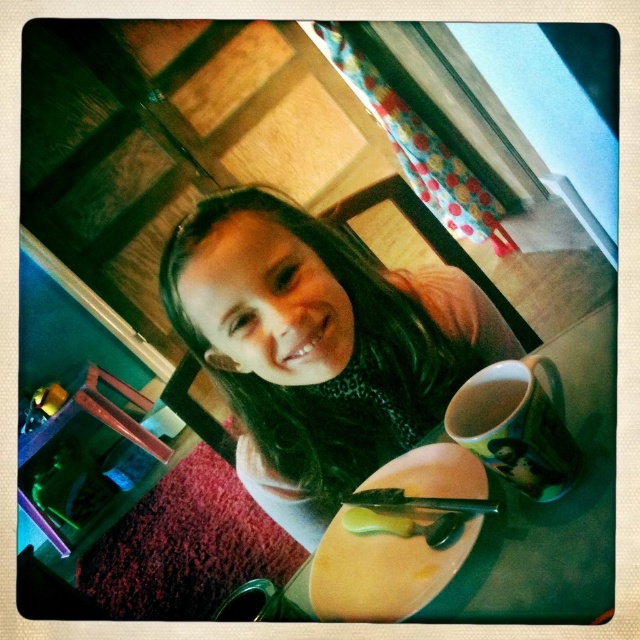
You are a guest at this table and want to place a small napkin between the yellow matte plate at center and the yellow buttery spread at lower center. Which object has a larger width to accommodate the napkin?

The yellow matte plate at center has a larger width than the yellow buttery spread at lower center, so it can accommodate the napkin better.

You are setting up a tea tray and need to place the yellow matte plate at center and the yellow buttery spread at lower center. According to the scene, which item should be placed to the left of the other?

The yellow buttery spread at lower center should be placed to the left of the yellow matte plate at center because the yellow matte plate at center is positioned on the right side of the yellow buttery spread at lower center.

You are setting up a table for a tea party and have the yellow matte plate at center and the green matte mug at lower right. To arrange them symmetrically, which object should you move to the right side of the other?

The yellow matte plate at center is positioned on the left side of green matte mug at lower right. To create symmetry, you should move the green matte mug at lower right to the right side of the yellow matte plate at center, balancing their positions.